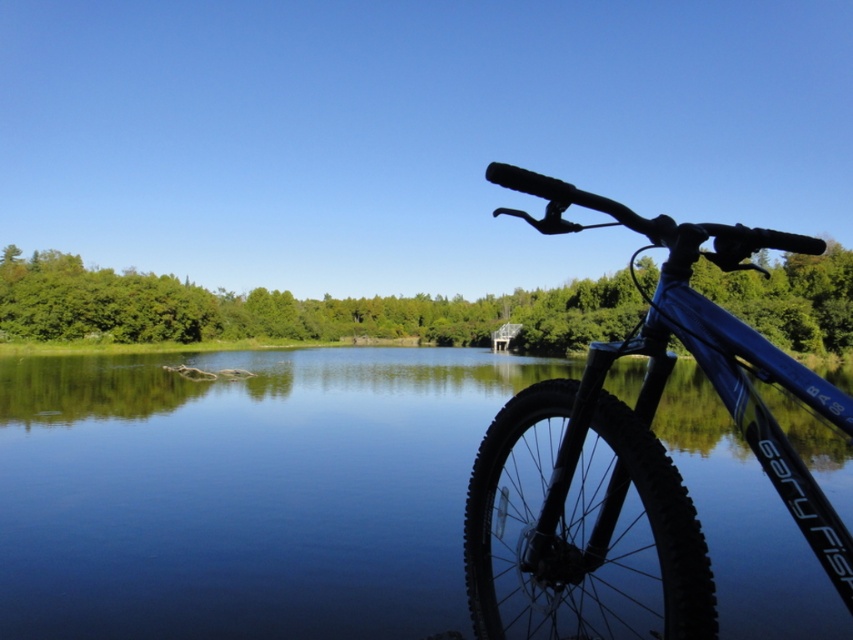
You are standing at the lakeside and want to take a photo of both the glossy blue water at center and the blue matte bicycle at right. Which object will appear larger in your photo?

The glossy blue water at center will appear larger in the photo because it is closer to the viewer than the blue matte bicycle at right.

Based on the photo, you are standing at the lakeside and want to take a photo of both the glossy blue water at center and the blue matte bicycle at right. Which object should you zoom in on to ensure both fit in the frame?

The glossy blue water at center is smaller than the blue matte bicycle at right, so you should zoom in on the blue matte bicycle at right to ensure both fit in the frame.

You are standing at point (689, 234) and want to walk to the lake. Is the point (231, 499) between you and the lake?

Point (231, 499) is behind point (689, 234), so yes, the point (231, 499) is between you and the lake.